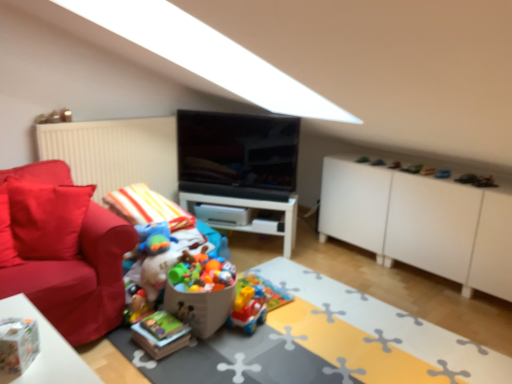
Image resolution: width=512 pixels, height=384 pixels. In order to click on vacant area that lies to the right of plastic colorful toy car at center, positioned as the 2th toy in left-to-right order in this screenshot , I will do `click(280, 320)`.